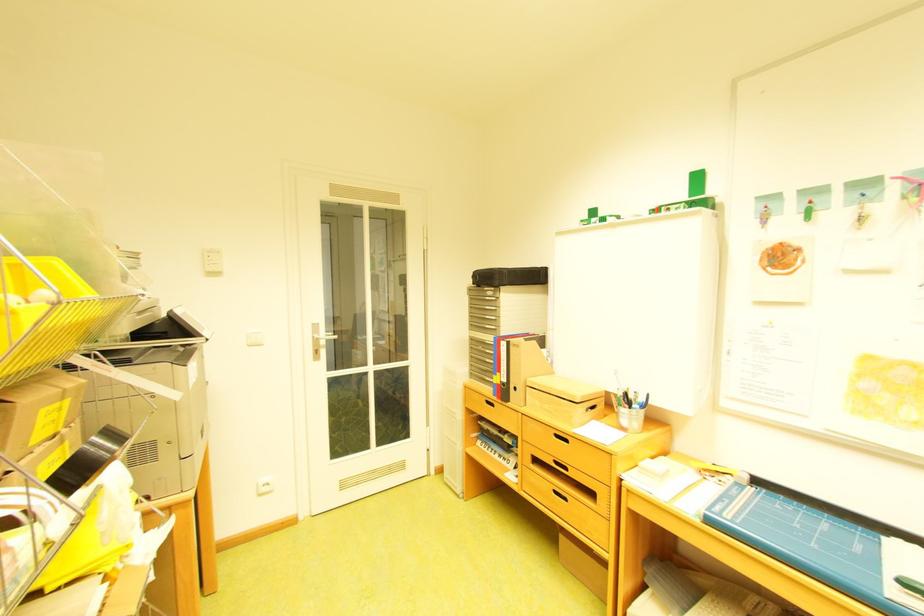
Locate an element on the screen. This screenshot has height=616, width=924. yellow plastic bin is located at coordinates (34, 297).